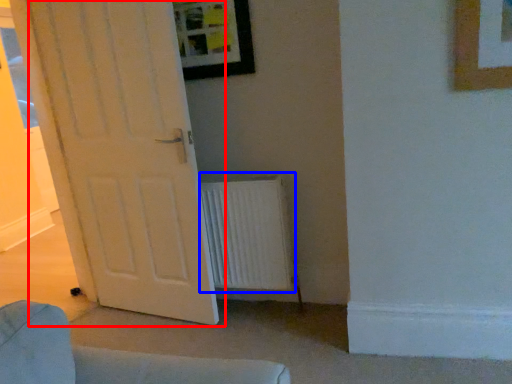
Question: Which object appears closest to the camera in this image, door (highlighted by a red box) or radiator (highlighted by a blue box)?

Choices:
 (A) door
 (B) radiator

Answer: (A)